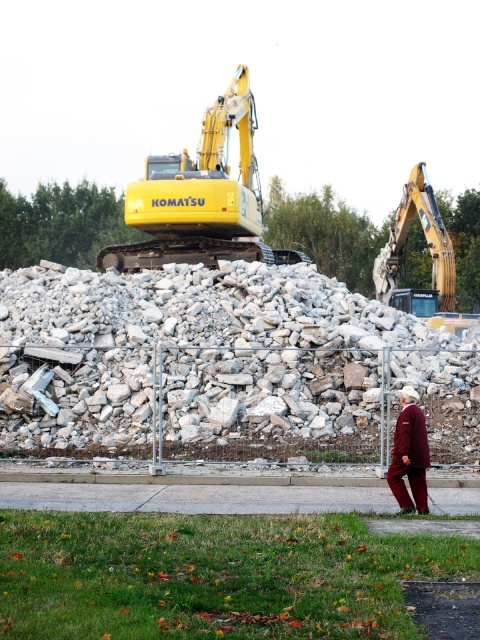
Who is positioned more to the right, white gravel at center or maroon fabric robe at lower right?

maroon fabric robe at lower right

Is white gravel at center above maroon fabric robe at lower right?

Yes.

Where is `white gravel at center`? This screenshot has width=480, height=640. white gravel at center is located at coordinates (218, 362).

This screenshot has width=480, height=640. I want to click on white gravel at center, so click(x=218, y=362).

Does point (455, 387) come in front of point (228, 221)?

Yes, point (455, 387) is closer to viewer.

At what (x,y) coordinates should I click in order to perform the action: click on white gravel at center. Please return your answer as a coordinate pair (x, y). This screenshot has width=480, height=640. Looking at the image, I should click on (218, 362).

Is yellow metallic excavator at upper center further to the viewer compared to maroon fabric robe at lower right?

Yes.

Is point (154, 198) farther from camera compared to point (408, 435)?

That is True.

The height and width of the screenshot is (640, 480). Find the location of `yellow metallic excavator at upper center`. yellow metallic excavator at upper center is located at coordinates (201, 196).